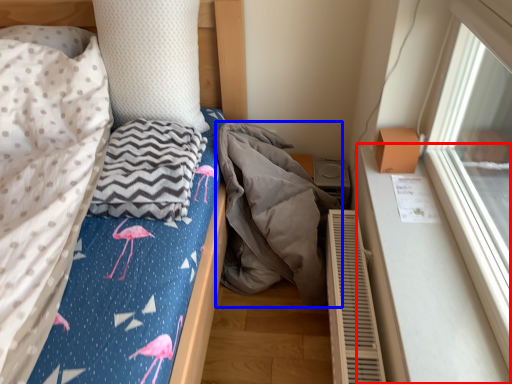
Question: Which of the following is the farthest to the observer, window sill (highlighted by a red box) or material (highlighted by a blue box)?

Choices:
 (A) window sill
 (B) material

Answer: (B)